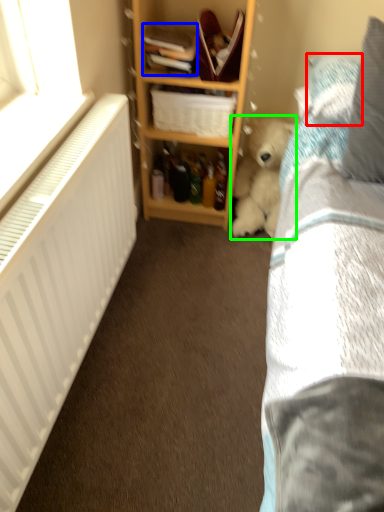
Question: Which object is positioned closest to pillow (highlighted by a red box)? Select from book (highlighted by a blue box) and teddy bear (highlighted by a green box).

Choices:
 (A) book
 (B) teddy bear

Answer: (B)